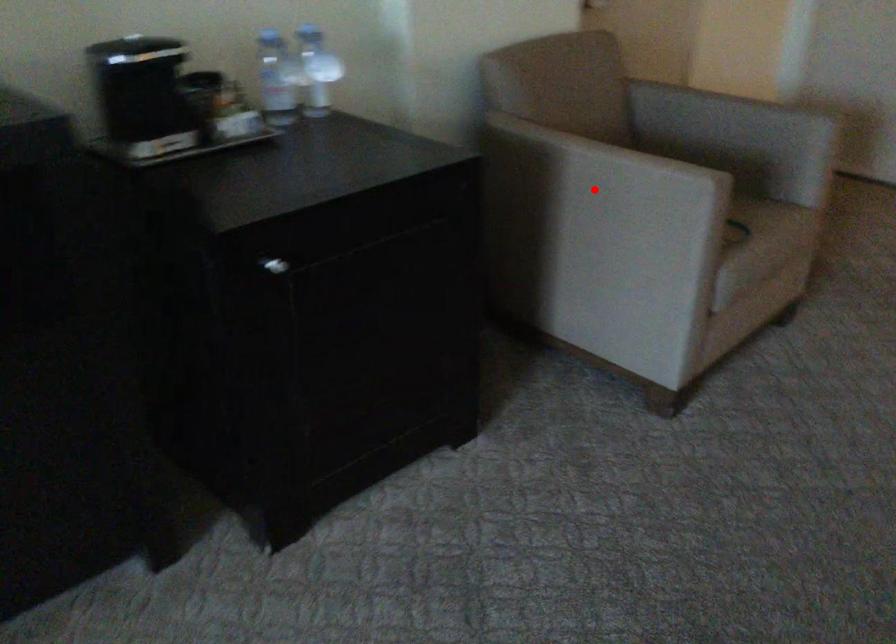
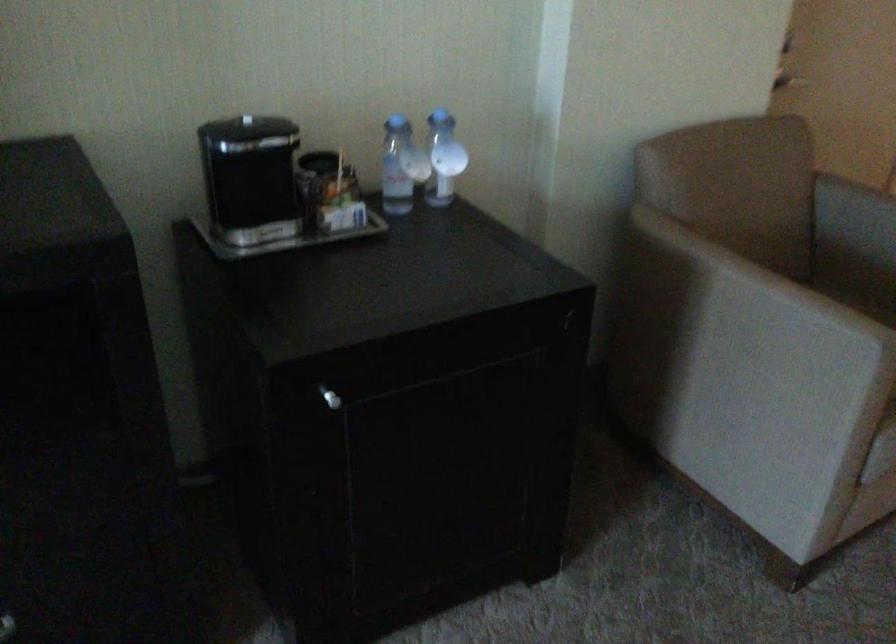
Question: I am providing you with two images of the same scene from different viewpoints. Given a red point in image1, look at the same physical point in image2. Is it:

Choices:
 (A) Closer to the viewpoint
 (B) Farther from the viewpoint

Answer: (A)